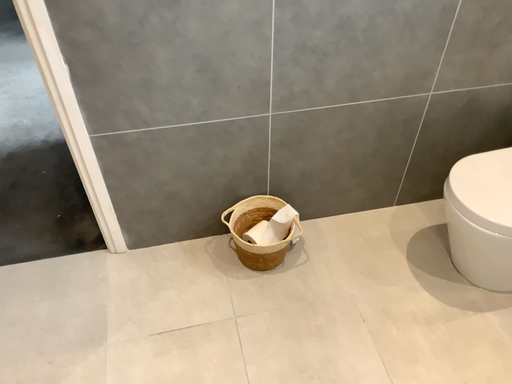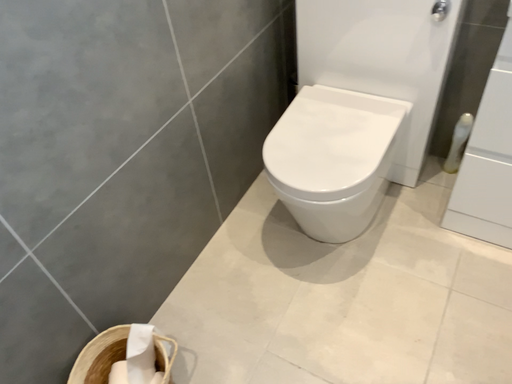
Question: How did the camera likely rotate when shooting the video?

Choices:
 (A) rotated downward
 (B) rotated upward

Answer: (B)